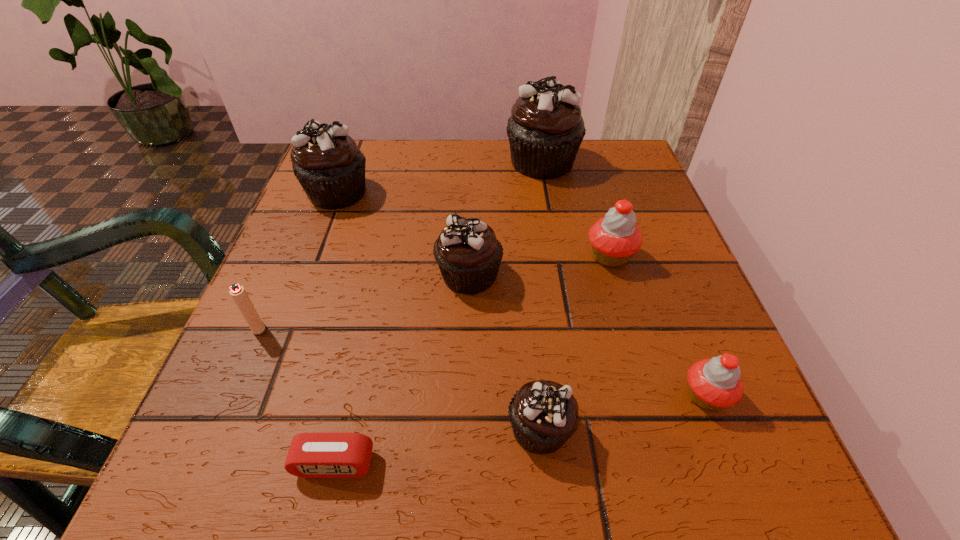
At what (x,y) coordinates should I click in order to perform the action: click on free space at the right edge of the desktop. Please return your answer as a coordinate pair (x, y). The width and height of the screenshot is (960, 540). Looking at the image, I should click on (638, 383).

What are the coordinates of `free location at the far left corner of the desktop` in the screenshot? It's located at (386, 140).

Where is `blank space at the near left corner`? blank space at the near left corner is located at coordinates (192, 472).

Locate an element on the screen. free spot between the tallest cupcake and the third biggest brown cupcake is located at coordinates pos(506,219).

Where is `vacant space that's between the shortest object and the second biggest brown cupcake`? This screenshot has width=960, height=540. vacant space that's between the shortest object and the second biggest brown cupcake is located at coordinates (336, 328).

Identify the location of blank region between the nearer red cupcake and the leftmost brown cupcake. (521, 294).

This screenshot has height=540, width=960. I want to click on free space between the second nearest brown cupcake and the smaller red cupcake, so click(x=588, y=335).

Locate an element on the screen. This screenshot has width=960, height=540. vacant space in between the tallest cupcake and the third object from left to right is located at coordinates (439, 313).

This screenshot has height=540, width=960. Find the location of `unoccupied area between the farther red cupcake and the igniter`. unoccupied area between the farther red cupcake and the igniter is located at coordinates (434, 292).

Locate an element on the screen. free space between the tallest cupcake and the alarm clock is located at coordinates (439, 313).